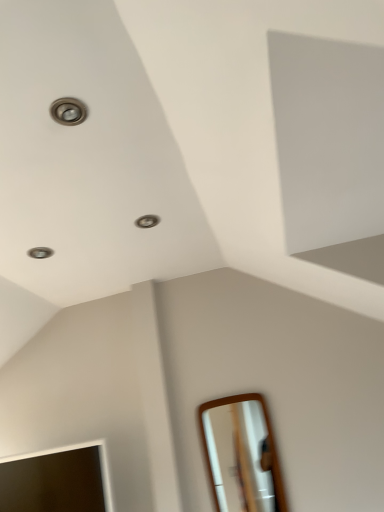
Measure the distance between matte wooden mirror at lower left, which is the first mirror in left-to-right order, and camera.

6.32 feet.

This screenshot has height=512, width=384. What do you see at coordinates (57, 481) in the screenshot? I see `matte wooden mirror at lower left, placed as the second mirror when sorted from right to left` at bounding box center [57, 481].

Find the location of a particular element. Image resolution: width=384 pixels, height=512 pixels. matte wooden mirror at lower left, placed as the second mirror when sorted from right to left is located at coordinates pos(57,481).

Measure the distance between point (257,455) and camera.

Point (257,455) is 2.07 meters away from camera.

The width and height of the screenshot is (384, 512). What do you see at coordinates (239, 457) in the screenshot? I see `white glossy mirror at lower right, marked as the first mirror in a right-to-left arrangement` at bounding box center [239, 457].

You are a GUI agent. You are given a task and a screenshot of the screen. Output one action in this format:
    pyautogui.click(x=<x>, y=<y>)
    Task: Click on the white glossy mirror at lower right, marked as the first mirror in a right-to-left arrangement
    Image resolution: width=384 pixels, height=512 pixels.
    Given the screenshot: What is the action you would take?
    pyautogui.click(x=239, y=457)

This screenshot has height=512, width=384. I want to click on matte wooden mirror at lower left, placed as the second mirror when sorted from right to left, so (x=57, y=481).

Considering the positions of objects white glossy mirror at lower right, the second mirror viewed from the left, and matte wooden mirror at lower left, placed as the second mirror when sorted from right to left, in the image provided, who is more to the left, white glossy mirror at lower right, the second mirror viewed from the left, or matte wooden mirror at lower left, placed as the second mirror when sorted from right to left,?

Positioned to the left is matte wooden mirror at lower left, placed as the second mirror when sorted from right to left.

Is the position of white glossy mirror at lower right, the second mirror viewed from the left, more distant than that of matte wooden mirror at lower left, placed as the second mirror when sorted from right to left?

Yes, white glossy mirror at lower right, the second mirror viewed from the left, is further from the camera.

Considering the points (237, 486) and (8, 502), which point is in front, point (237, 486) or point (8, 502)?

The point (8, 502) is more forward.

From the image's perspective, which is above, white glossy mirror at lower right, marked as the first mirror in a right-to-left arrangement, or matte wooden mirror at lower left, placed as the second mirror when sorted from right to left?

white glossy mirror at lower right, marked as the first mirror in a right-to-left arrangement, appears higher in the image.

From a real-world perspective, is white glossy mirror at lower right, the second mirror viewed from the left, beneath matte wooden mirror at lower left, placed as the second mirror when sorted from right to left?

Yes.

Considering the sizes of white glossy mirror at lower right, marked as the first mirror in a right-to-left arrangement, and matte wooden mirror at lower left, which is the first mirror in left-to-right order, in the image, is white glossy mirror at lower right, marked as the first mirror in a right-to-left arrangement, wider or thinner than matte wooden mirror at lower left, which is the first mirror in left-to-right order,?

white glossy mirror at lower right, marked as the first mirror in a right-to-left arrangement, is thinner than matte wooden mirror at lower left, which is the first mirror in left-to-right order.

Is white glossy mirror at lower right, the second mirror viewed from the left, shorter than matte wooden mirror at lower left, placed as the second mirror when sorted from right to left?

No, white glossy mirror at lower right, the second mirror viewed from the left, is not shorter than matte wooden mirror at lower left, placed as the second mirror when sorted from right to left.

Does white glossy mirror at lower right, the second mirror viewed from the left, have a larger size compared to matte wooden mirror at lower left, placed as the second mirror when sorted from right to left?

Incorrect, white glossy mirror at lower right, the second mirror viewed from the left, is not larger than matte wooden mirror at lower left, placed as the second mirror when sorted from right to left.

Would you say matte wooden mirror at lower left, which is the first mirror in left-to-right order, is part of white glossy mirror at lower right, marked as the first mirror in a right-to-left arrangement,'s contents?

No, matte wooden mirror at lower left, which is the first mirror in left-to-right order, is not a part of white glossy mirror at lower right, marked as the first mirror in a right-to-left arrangement.

Would you say white glossy mirror at lower right, the second mirror viewed from the left, is a long distance from matte wooden mirror at lower left, placed as the second mirror when sorted from right to left?

Indeed, white glossy mirror at lower right, the second mirror viewed from the left, is not near matte wooden mirror at lower left, placed as the second mirror when sorted from right to left.

Based on the photo, is white glossy mirror at lower right, the second mirror viewed from the left, facing away from matte wooden mirror at lower left, placed as the second mirror when sorted from right to left?

white glossy mirror at lower right, the second mirror viewed from the left, is not turned away from matte wooden mirror at lower left, placed as the second mirror when sorted from right to left.

From the picture: Can you tell me how much white glossy mirror at lower right, marked as the first mirror in a right-to-left arrangement, and matte wooden mirror at lower left, which is the first mirror in left-to-right order, differ in facing direction?

They differ by 0.741 degrees in their facing directions.

Measure the distance from white glossy mirror at lower right, marked as the first mirror in a right-to-left arrangement, to matte wooden mirror at lower left, placed as the second mirror when sorted from right to left.

2.21 meters.

This screenshot has width=384, height=512. What are the coordinates of `mirror that appears below the white glossy mirror at lower right, marked as the first mirror in a right-to-left arrangement (from the image's perspective)` in the screenshot? It's located at (57, 481).

Considering the relative positions of matte wooden mirror at lower left, which is the first mirror in left-to-right order, and white glossy mirror at lower right, marked as the first mirror in a right-to-left arrangement, in the image provided, is matte wooden mirror at lower left, which is the first mirror in left-to-right order, to the right of white glossy mirror at lower right, marked as the first mirror in a right-to-left arrangement, from the viewer's perspective?

In fact, matte wooden mirror at lower left, which is the first mirror in left-to-right order, is to the left of white glossy mirror at lower right, marked as the first mirror in a right-to-left arrangement.

Based on the photo, which object is closer to the camera, matte wooden mirror at lower left, which is the first mirror in left-to-right order, or white glossy mirror at lower right, marked as the first mirror in a right-to-left arrangement?

matte wooden mirror at lower left, which is the first mirror in left-to-right order.

Considering the positions of point (103, 460) and point (217, 497), is point (103, 460) closer or farther from the camera than point (217, 497)?

Point (103, 460) appears to be closer to the viewer than point (217, 497).

From the image's perspective, between matte wooden mirror at lower left, which is the first mirror in left-to-right order, and white glossy mirror at lower right, marked as the first mirror in a right-to-left arrangement, which one is located above?

white glossy mirror at lower right, marked as the first mirror in a right-to-left arrangement, is shown above in the image.

From a real-world perspective, does matte wooden mirror at lower left, which is the first mirror in left-to-right order, sit lower than white glossy mirror at lower right, the second mirror viewed from the left?

No.

Looking at this image, which of these two, matte wooden mirror at lower left, placed as the second mirror when sorted from right to left, or white glossy mirror at lower right, the second mirror viewed from the left, is wider?

matte wooden mirror at lower left, placed as the second mirror when sorted from right to left, is wider.

Is matte wooden mirror at lower left, placed as the second mirror when sorted from right to left, shorter than white glossy mirror at lower right, marked as the first mirror in a right-to-left arrangement?

Yes.

Who is bigger, matte wooden mirror at lower left, which is the first mirror in left-to-right order, or white glossy mirror at lower right, marked as the first mirror in a right-to-left arrangement?

matte wooden mirror at lower left, which is the first mirror in left-to-right order, is bigger.

Is matte wooden mirror at lower left, placed as the second mirror when sorted from right to left, completely or partially outside of white glossy mirror at lower right, the second mirror viewed from the left?

Yes, matte wooden mirror at lower left, placed as the second mirror when sorted from right to left, is located beyond the bounds of white glossy mirror at lower right, the second mirror viewed from the left.

Is matte wooden mirror at lower left, which is the first mirror in left-to-right order, positioned far away from white glossy mirror at lower right, marked as the first mirror in a right-to-left arrangement?

Yes, matte wooden mirror at lower left, which is the first mirror in left-to-right order, and white glossy mirror at lower right, marked as the first mirror in a right-to-left arrangement, are located far from each other.

Consider the image. Is matte wooden mirror at lower left, which is the first mirror in left-to-right order, looking in the opposite direction of white glossy mirror at lower right, marked as the first mirror in a right-to-left arrangement?

No, matte wooden mirror at lower left, which is the first mirror in left-to-right order, is not facing the opposite direction of white glossy mirror at lower right, marked as the first mirror in a right-to-left arrangement.

The width and height of the screenshot is (384, 512). I want to click on mirror above the matte wooden mirror at lower left, placed as the second mirror when sorted from right to left (from the image's perspective), so click(239, 457).

Locate an element on the screen. The height and width of the screenshot is (512, 384). mirror below the white glossy mirror at lower right, marked as the first mirror in a right-to-left arrangement (from the image's perspective) is located at coordinates [57, 481].

The image size is (384, 512). What are the coordinates of `mirror on the left side of white glossy mirror at lower right, the second mirror viewed from the left` in the screenshot? It's located at (57, 481).